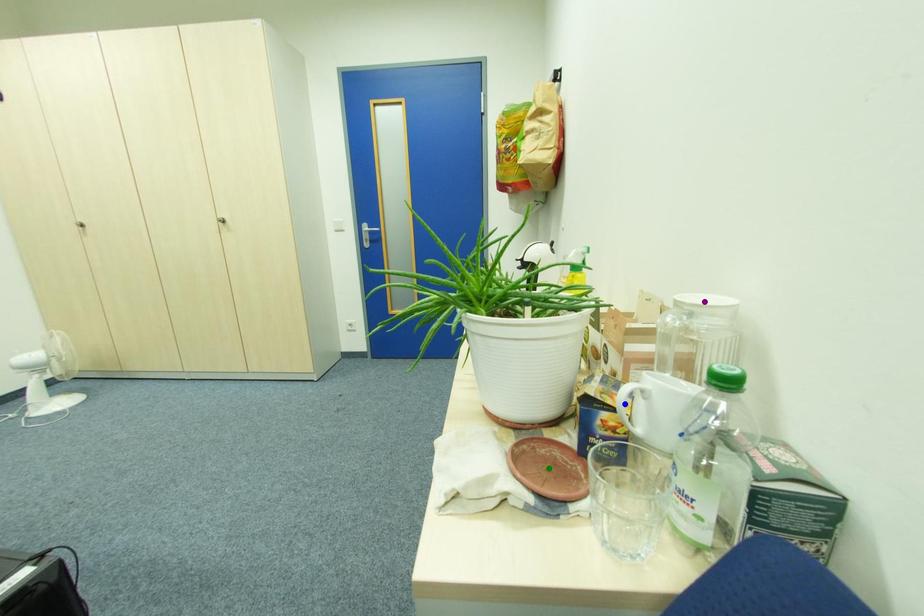
Order these from nearest to farthest:
A) blue point
B) green point
C) purple point

purple point → green point → blue point